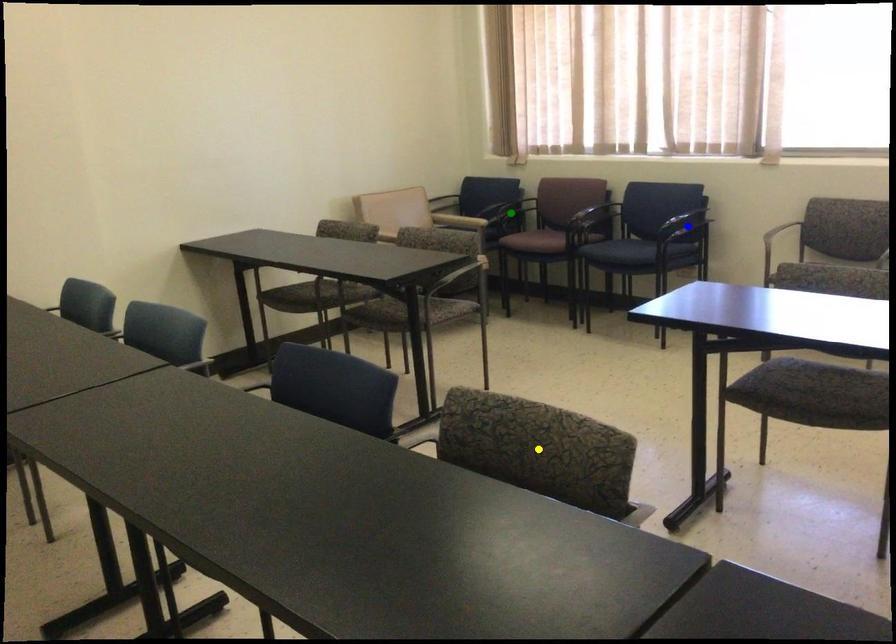
Order these from nearest to farthest:
green point | blue point | yellow point

yellow point
blue point
green point